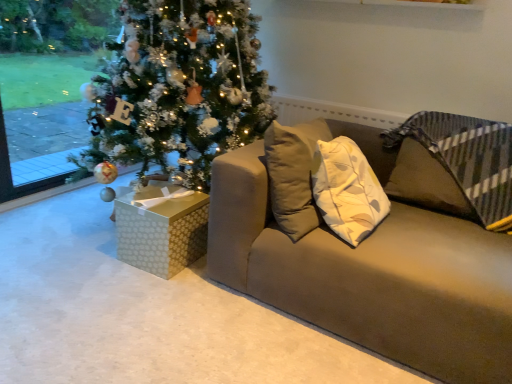
At what (x,y) coordinates should I click in order to perform the action: click on free spot above gold-patterned gift box at lower left (from a real-world perspective). Please return your answer as a coordinate pair (x, y). The image size is (512, 384). Looking at the image, I should click on (170, 193).